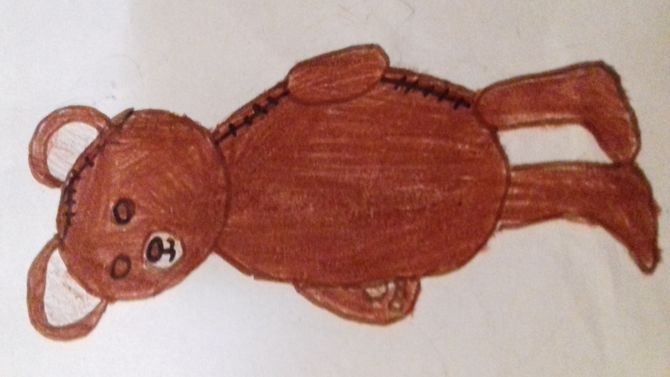
Where is `teddy bear`? The width and height of the screenshot is (670, 377). teddy bear is located at coordinates (372, 200).